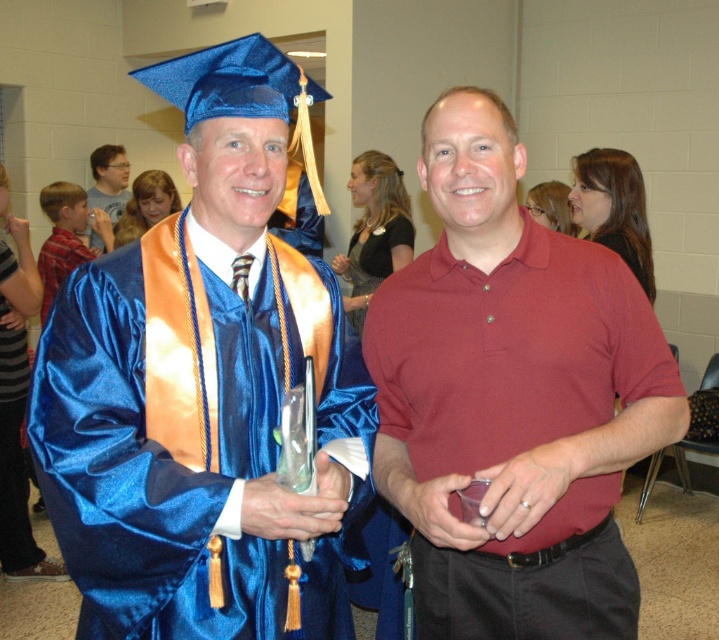
Who is more forward, (633, 632) or (100, 241)?

Point (633, 632)

Which is in front, point (500, 577) or point (96, 204)?

Point (500, 577) is in front.

Where is `matte red polo shirt at center`? The height and width of the screenshot is (640, 719). matte red polo shirt at center is located at coordinates (512, 397).

Which of these two, blue satin gown at left or matte plastic water bottle at left, stands shorter?

With less height is matte plastic water bottle at left.

Between blue satin gown at left and matte plastic water bottle at left, which one is positioned higher?

matte plastic water bottle at left is above.

This screenshot has width=719, height=640. What are the coordinates of `blue satin gown at left` in the screenshot? It's located at (13, 456).

Does satin blue graduation gown at left appear on the right side of matte red polo shirt at center?

In fact, satin blue graduation gown at left is to the left of matte red polo shirt at center.

Does satin blue graduation gown at left lie in front of matte red polo shirt at center?

No, it is behind matte red polo shirt at center.

At what (x,y) coordinates should I click in order to perform the action: click on satin blue graduation gown at left. Please return your answer as a coordinate pair (x, y). The height and width of the screenshot is (640, 719). Looking at the image, I should click on (203, 390).

Locate an element on the screen. The width and height of the screenshot is (719, 640). satin blue graduation gown at left is located at coordinates [x=203, y=390].